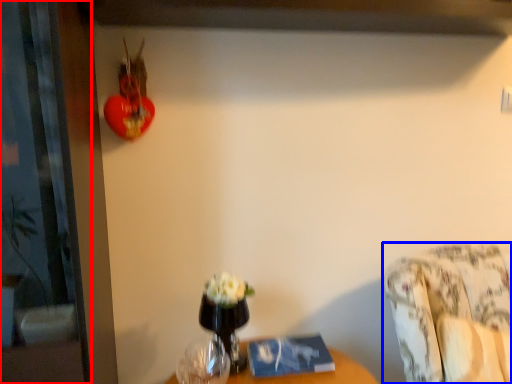
Question: Which of the following is the farthest to the observer, screen door (highlighted by a red box) or furniture (highlighted by a blue box)?

Choices:
 (A) screen door
 (B) furniture

Answer: (B)